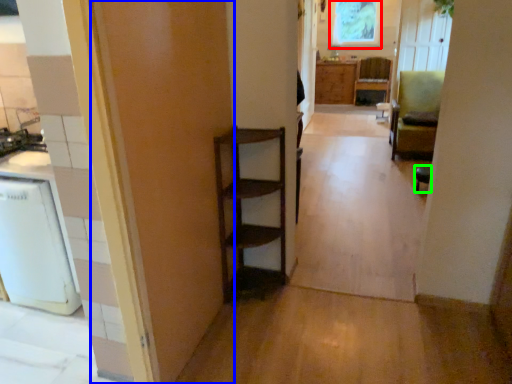
Question: Which object is positioned closest to window screen (highlighted by a red box)? Select from door (highlighted by a blue box) and chair (highlighted by a green box).

Choices:
 (A) door
 (B) chair

Answer: (B)